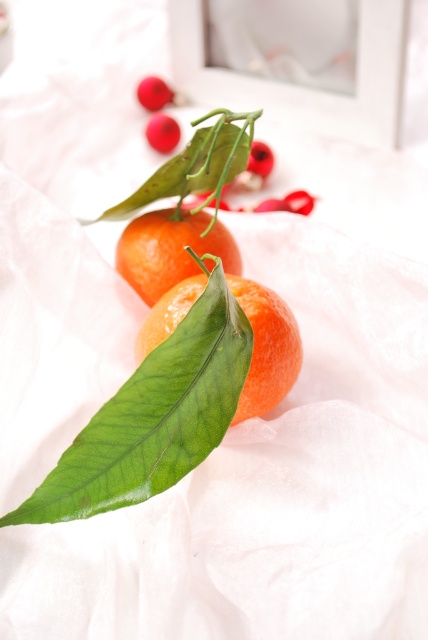
You are standing in front of the image of two tangerines on a white fabric with green leaves and red ornaments in the background. There are two points marked in the image. If you were to reach out to touch one of them, which point would require you to reach further forward, point at coordinate point (x=172, y=307) or point at coordinate point (x=205, y=225)?

Point at coordinate point (x=205, y=225) requires reaching further forward because it is farther from the viewer compared to point at coordinate point (x=172, y=307), which is closer.

You are arranging a festive table and want to place the green glossy leaf at center and the glossy orange at center on a small plate. Which object will require more space on the plate due to its size?

The green glossy leaf at center requires more space on the plate because its width is larger than the glossy orange at center.